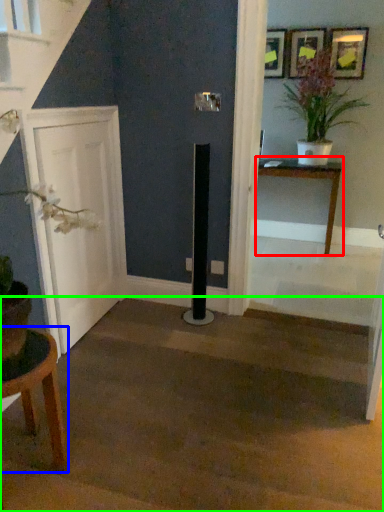
Question: Estimate the real-world distances between objects in this image. Which object is farther from table (highlighted by a red box), table (highlighted by a blue box) or stairwell (highlighted by a green box)?

Choices:
 (A) table
 (B) stairwell

Answer: (A)